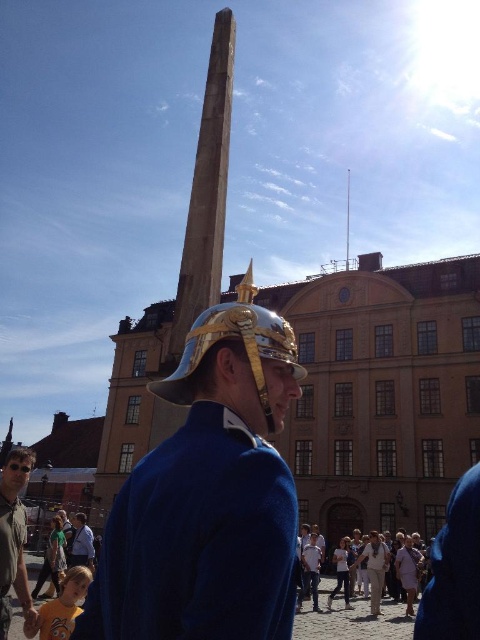
You are standing in front of the historic building in the scene and want to locate the gold plated helmet at center. Based on the coordinates provided, where should you look relative to your position?

The gold plated helmet at center is located at coordinates point [242,348], which means it is positioned slightly to the right and halfway up from the bottom of your field of view.

You are a photographer trying to capture a clear shot of the matte gray shirt at lower left without the metallic helmet at center blocking it. Based on their positions, is this possible?

The metallic helmet at center is positioned over the matte gray shirt at lower left, so it would block the view of the shirt. To capture the shirt without obstruction, you would need to adjust your angle or position to move the helmet out of the frame.